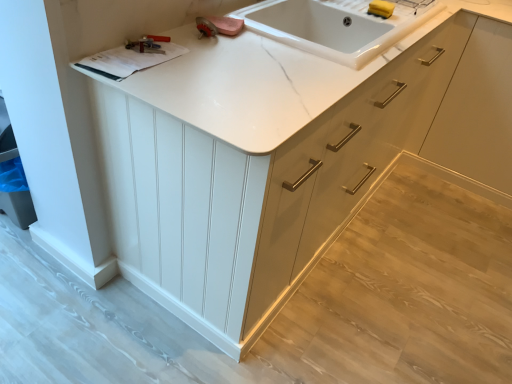
The width and height of the screenshot is (512, 384). I want to click on metallic silver tool at upper center, so click(x=148, y=44).

What do you see at coordinates (148, 44) in the screenshot?
I see `metallic silver tool at upper center` at bounding box center [148, 44].

Find the location of a particular element. metallic silver tool at upper center is located at coordinates (148, 44).